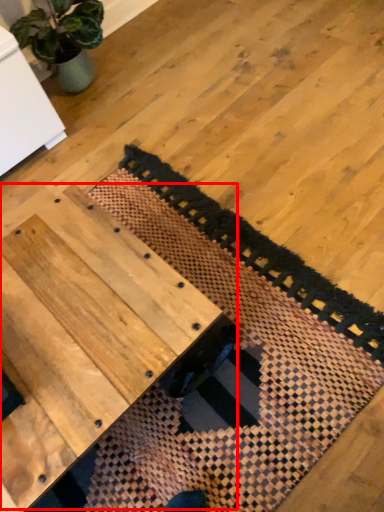
Question: From the image's perspective, where is table (annotated by the red box) located relative to mat?

Choices:
 (A) below
 (B) above

Answer: (A)